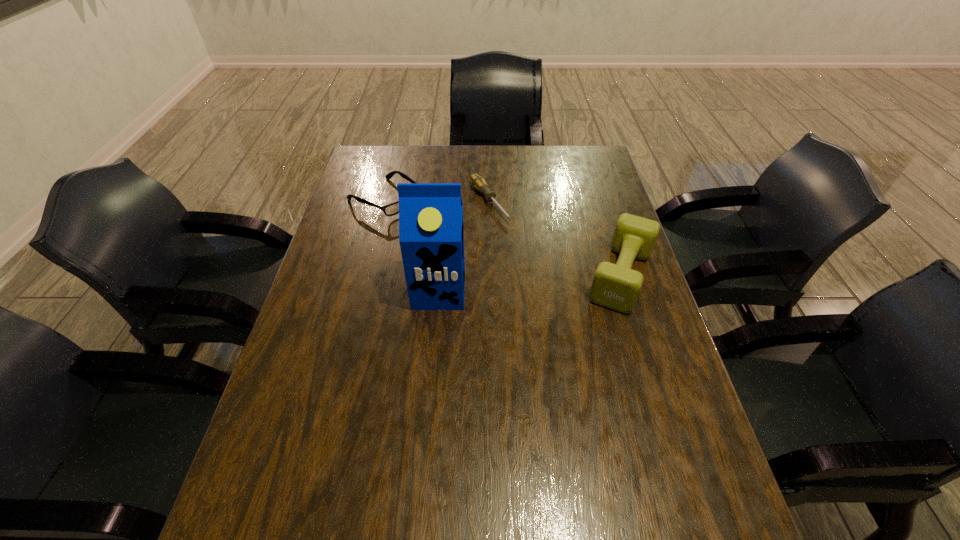
I want to click on the tallest object, so click(431, 233).

Where is `carton`? The height and width of the screenshot is (540, 960). carton is located at coordinates (431, 233).

At what (x,y) coordinates should I click in order to perform the action: click on the rightmost object. Please return your answer as a coordinate pair (x, y). The height and width of the screenshot is (540, 960). Looking at the image, I should click on (616, 286).

Locate an element on the screen. The image size is (960, 540). the second tallest object is located at coordinates (616, 286).

What are the coordinates of `the shortest object` in the screenshot? It's located at (479, 183).

This screenshot has height=540, width=960. I want to click on the third object from left to right, so click(x=479, y=183).

The height and width of the screenshot is (540, 960). Identify the location of spectacles. (392, 209).

I want to click on the leftmost object, so tap(392, 209).

You are a GUI agent. You are given a task and a screenshot of the screen. Output one action in this format:
    pyautogui.click(x=<x>, y=<y>)
    Task: Click on the free region located with the cap open on the tallest object
    
    Given the screenshot: What is the action you would take?
    pyautogui.click(x=425, y=451)

Identify the location of blank space located 0.290m on the left of the rightmost object. The image size is (960, 540). (479, 276).